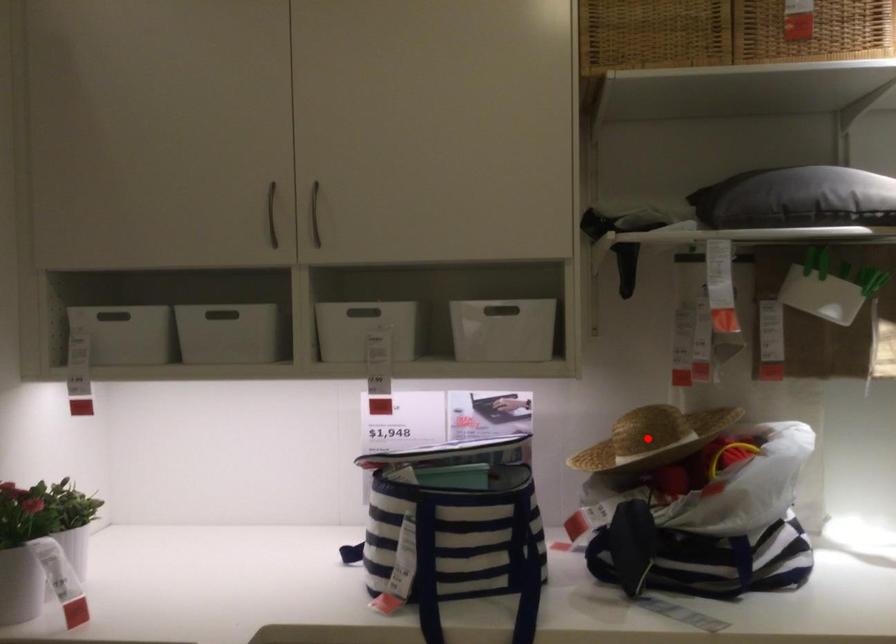
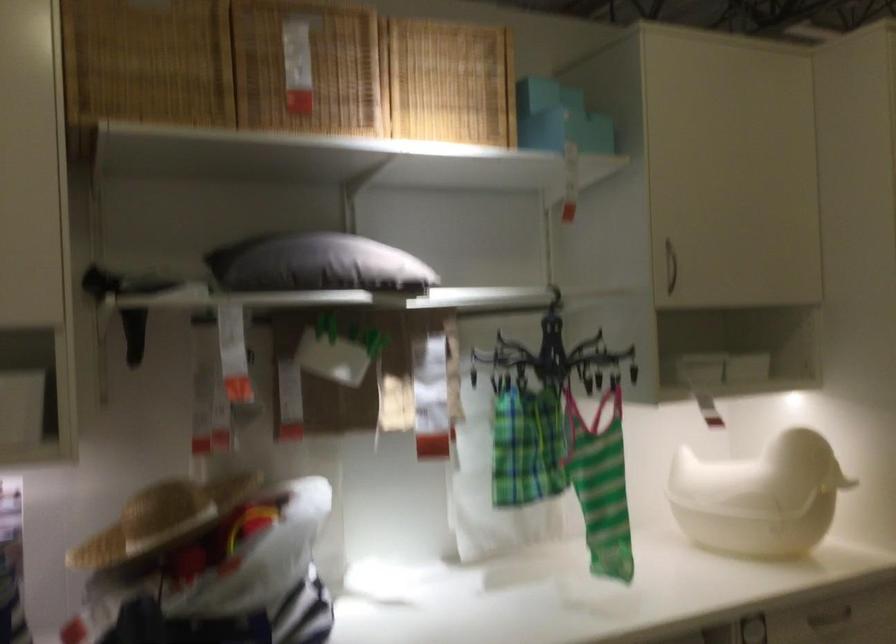
Question: I am providing you with two images of the same scene from different viewpoints. A red point is marked on the first image. At the location where the point appears in image 1, is it still visible in image 2?

Choices:
 (A) Yes
 (B) No

Answer: (A)